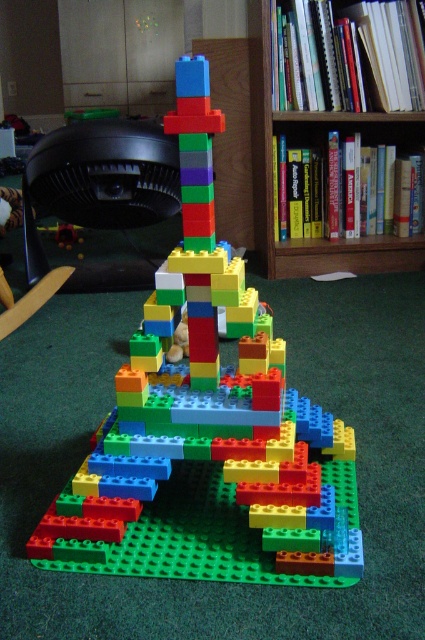
You are a child who wants to reach the wooden bookshelf at upper center to grab a book. There is a multicolored plastic blocks at center in the way. Can you walk around it to reach the bookshelf?

The multicolored plastic blocks at center is in front of the wooden bookshelf at upper center, so you can walk around it to reach the bookshelf.

You are looking at the LEGO Eiffel Tower and want to place a small LEGO figure between the two points, point (209, 145) and point (354, 120). Which point should the figure be closer to in order to be in front of the other point?

The small LEGO figure should be placed closer to point (209, 145) because it is in front of point (354, 120).

You are a child trying to place a small toy car on the multicolored plastic blocks at center and the wooden bookshelf at upper center. Which object can the toy car fit on better?

The multicolored plastic blocks at center has a larger size compared to wooden bookshelf at upper center, so the toy car can fit better on the multicolored plastic blocks at center.